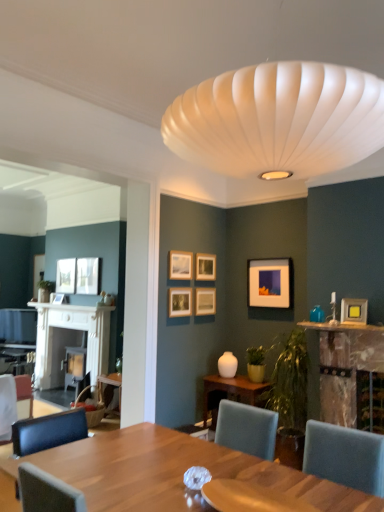
Identify the location of vacant region to the left of matte yellow picture frame at upper right, the ninth picture frame positioned from the back. (336, 324).